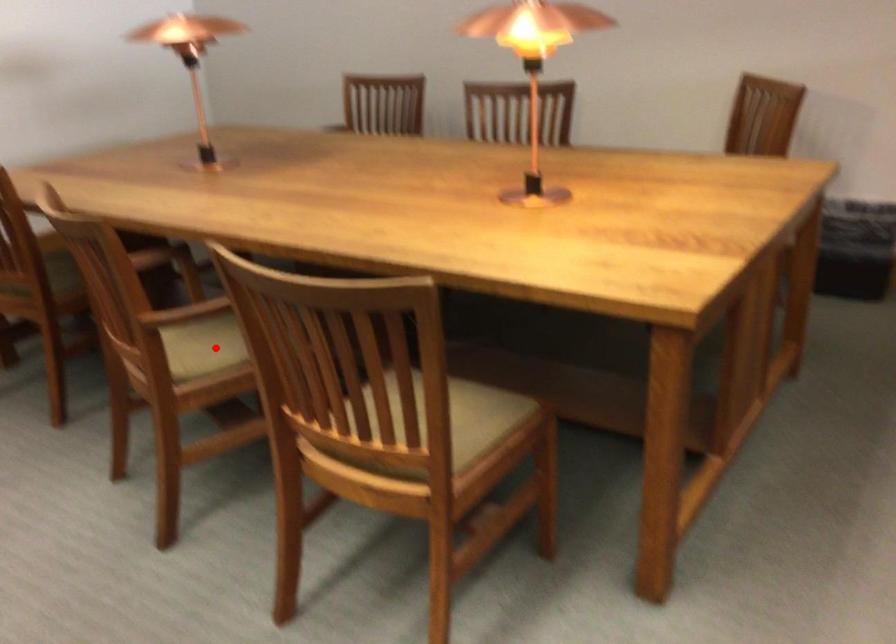
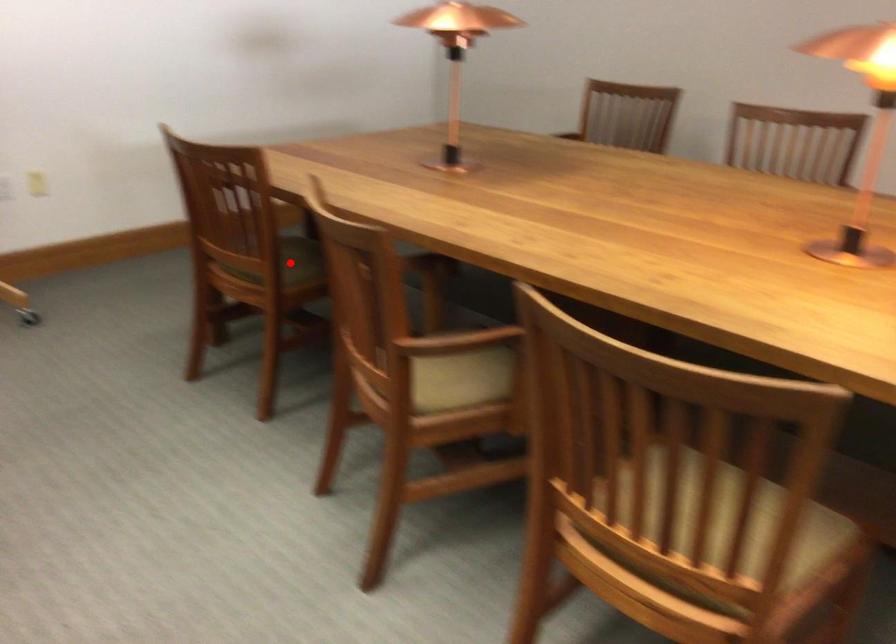
I am providing you with two images of the same scene from different viewpoints. A red point is marked on the first image and another point is marked on the second image. Do the highlighted points in image1 and image2 indicate the same real-world spot?

No